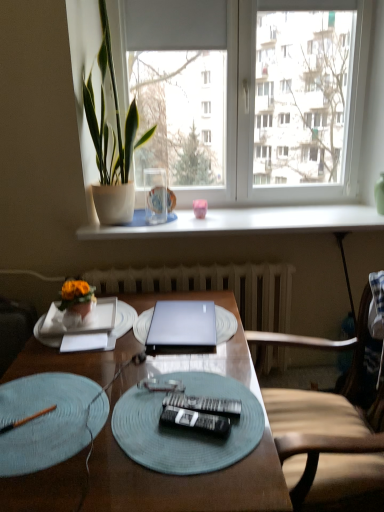
Question: Looking at the image, does wooden at right seem bigger or smaller compared to green leafy plant at left?

Choices:
 (A) big
 (B) small

Answer: (A)

Question: From a real-world perspective, is wooden at right physically located above or below green leafy plant at left?

Choices:
 (A) below
 (B) above

Answer: (A)

Question: Considering the real-world distances, which object is farthest from the white metallic radiator at center?

Choices:
 (A) wooden at right
 (B) light blue textured placemat at lower left
 (C) silver metallic laptop at center
 (D) pink matte coffee cup at center
 (E) black plastic remote control at center, the 1th remote control when ordered from front to back

Answer: (E)

Question: Which object is positioned closest to the wooden at right?

Choices:
 (A) black plastic remote control at center, the 1th remote control when ordered from front to back
 (B) wooden desk at center
 (C) white paper at left
 (D) light blue textured placemat at lower left
 (E) white paper at center

Answer: (B)